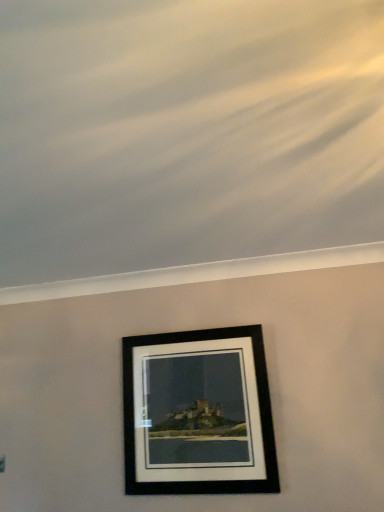
Where is `black matte picture frame at center`? black matte picture frame at center is located at coordinates (198, 413).

The width and height of the screenshot is (384, 512). Describe the element at coordinates (198, 413) in the screenshot. I see `black matte picture frame at center` at that location.

Image resolution: width=384 pixels, height=512 pixels. I want to click on black matte picture frame at center, so click(198, 413).